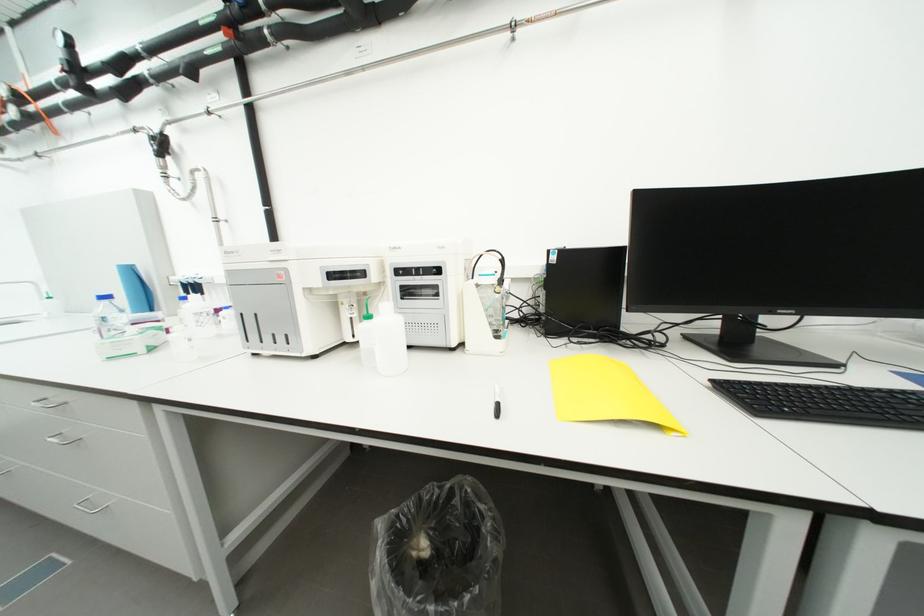
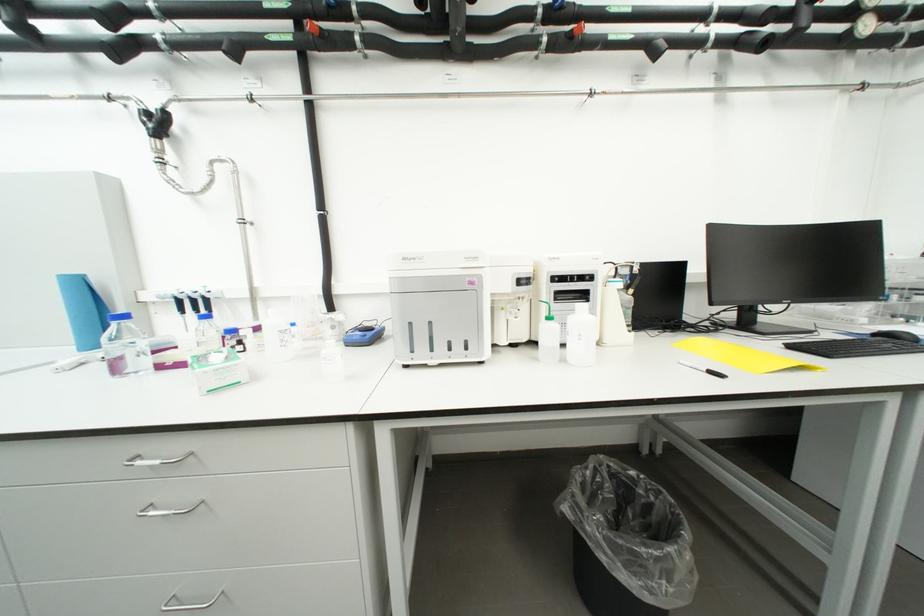
Question: Which direction would the cameraman need to move to produce the second image? Reply with the corresponding letter.

Choices:
 (A) Left
 (B) Right
 (C) Forward
 (D) Backward

Answer: (A)